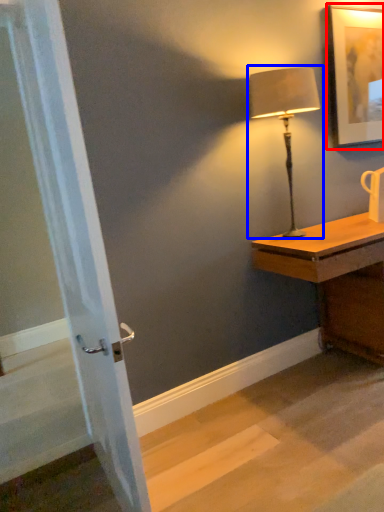
Question: Which object is further to the camera taking this photo, picture frame (highlighted by a red box) or lamp (highlighted by a blue box)?

Choices:
 (A) picture frame
 (B) lamp

Answer: (A)